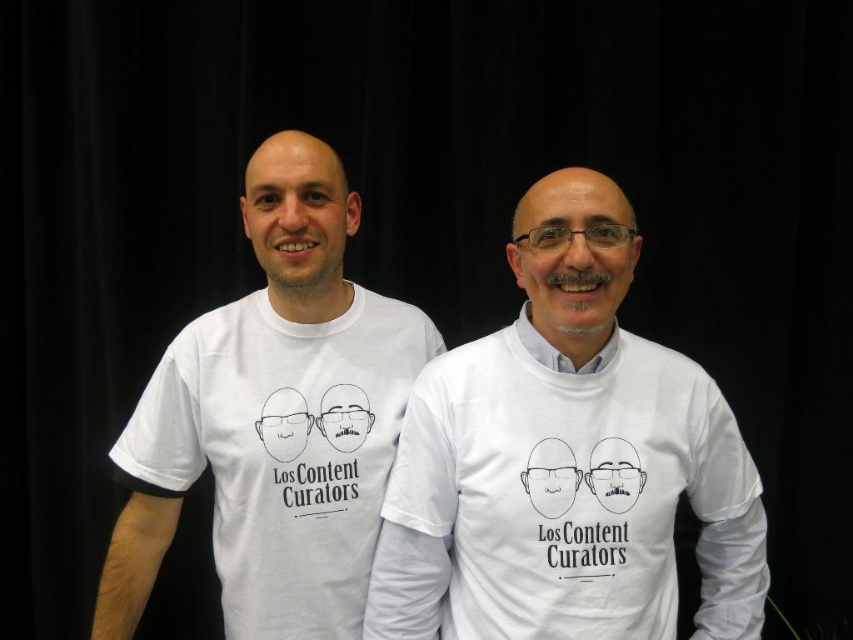
Question: Which point is farther from the camera taking this photo?

Choices:
 (A) (485, 484)
 (B) (166, 460)

Answer: (B)

Question: Does white cotton t-shirt at center lie behind white t-shirt at left?

Choices:
 (A) yes
 (B) no

Answer: (B)

Question: From the image, what is the correct spatial relationship of white cotton t-shirt at center in relation to white t-shirt at left?

Choices:
 (A) above
 (B) below

Answer: (B)

Question: Is white cotton t-shirt at center behind white t-shirt at left?

Choices:
 (A) no
 (B) yes

Answer: (A)